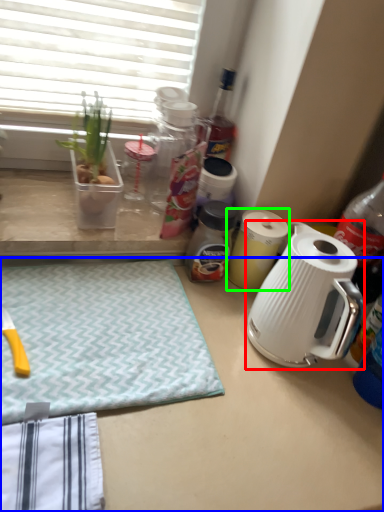
Question: Which object is the closest to the kettle (highlighted by a red box)? Choose among these: desk (highlighted by a blue box) or kitchen appliance (highlighted by a green box).

Choices:
 (A) desk
 (B) kitchen appliance

Answer: (B)